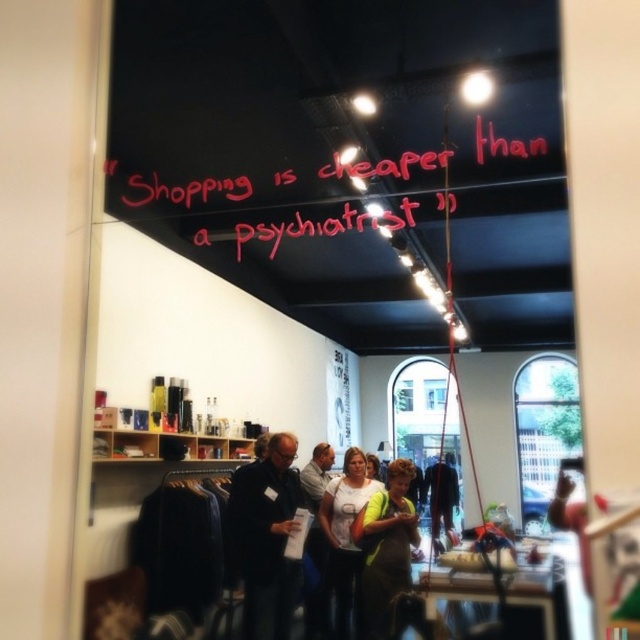
Can you confirm if dark blue shirt at center is smaller than neon green reflective vest at center?

Yes.

Describe the element at coordinates (266, 538) in the screenshot. I see `dark blue shirt at center` at that location.

I want to click on dark blue shirt at center, so click(266, 538).

Which is more to the right, dark blue shirt at center or white t-shirt at center?

From the viewer's perspective, white t-shirt at center appears more on the right side.

Does dark blue shirt at center have a smaller size compared to white t-shirt at center?

Yes, dark blue shirt at center is smaller than white t-shirt at center.

Where is `dark blue shirt at center`? The height and width of the screenshot is (640, 640). dark blue shirt at center is located at coordinates (266, 538).

Locate an element on the screen. The width and height of the screenshot is (640, 640). dark blue shirt at center is located at coordinates (266, 538).

Does neon green reflective vest at center have a larger size compared to dark blue jeans at center?

Incorrect, neon green reflective vest at center is not larger than dark blue jeans at center.

Who is more distant from viewer, (403, 582) or (445, 474)?

Positioned behind is point (445, 474).

At what (x,y) coordinates should I click in order to perform the action: click on neon green reflective vest at center. Please return your answer as a coordinate pair (x, y). Looking at the image, I should click on (387, 548).

At what (x,y) coordinates should I click in order to perform the action: click on neon green reflective vest at center. Please return your answer as a coordinate pair (x, y). The image size is (640, 640). Looking at the image, I should click on (387, 548).